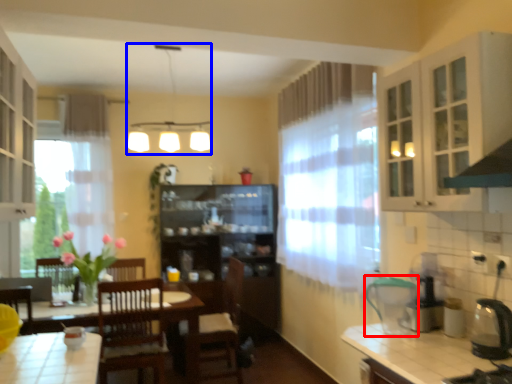
Question: Which object is closer to the camera taking this photo, appliance (highlighted by a red box) or light fixture (highlighted by a blue box)?

Choices:
 (A) appliance
 (B) light fixture

Answer: (A)